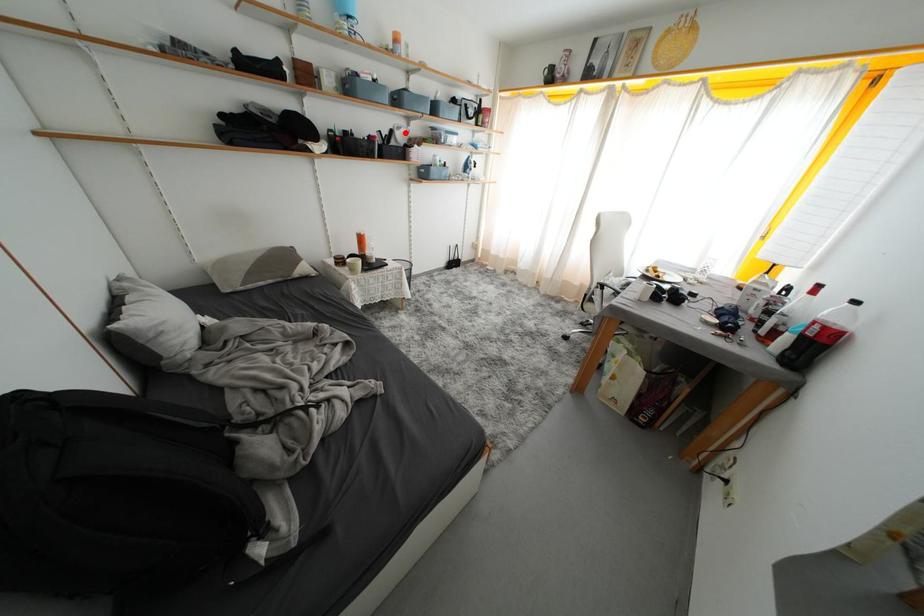
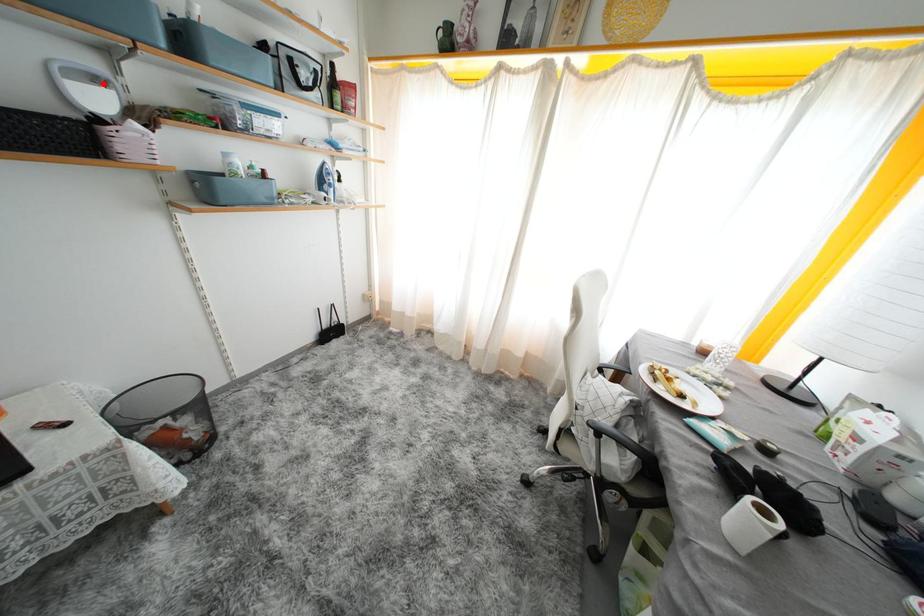
Consider the image. I am providing you with two images of the same scene from different viewpoints. A red point is marked on the first image and another point is marked on the second image. Are the points marked in image1 and image2 representing the same 3D position?

Yes